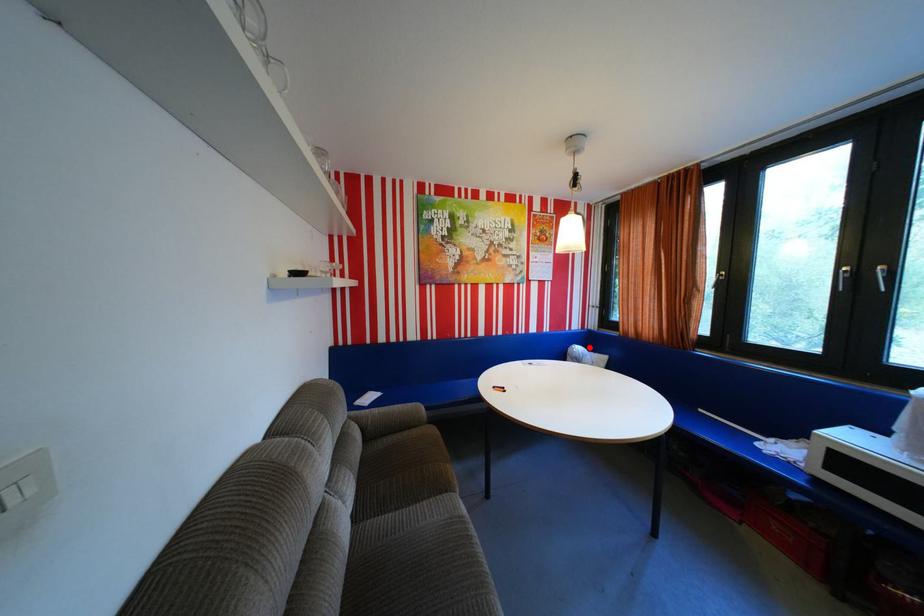
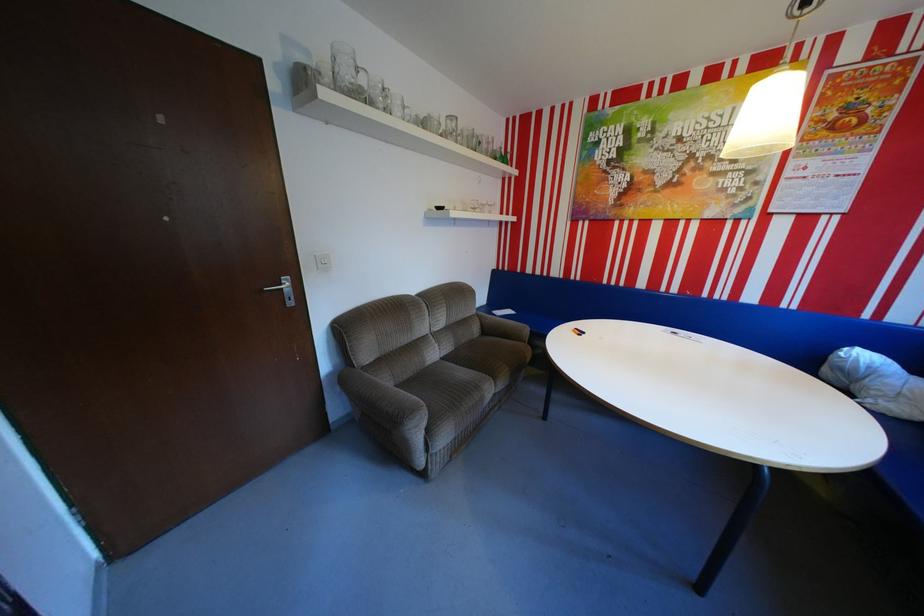
Where in the second image is the point corresponding to the highlighted location from the first image?

(874, 355)